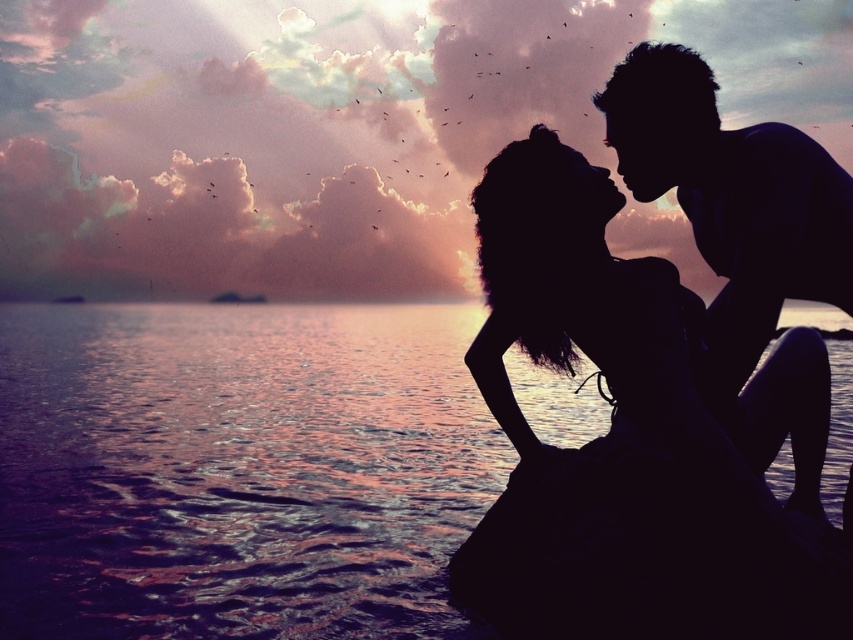
You are a photographer capturing this sunset scene. You want to focus on the point closer to the camera between the two points, point (775, 634) and point (671, 116). Which point should you adjust your camera to focus on?

You should focus on point (775, 634) because it is closer to the camera than point (671, 116).

You are a photographer trying to capture the couple in the sunset scene. The black matte dress at center and the silhouette man at upper right need to be in focus. If your camera has a depth of field that can sharply focus objects within 60 centimeters of each other, will both subjects be in focus?

The distance between the black matte dress at center and the silhouette man at upper right is 59.90 centimeters. Since this is within the 60 centimeter depth of field range, both subjects will be in focus.

You are a photographer planning to capture the sunset scene. You notice the reflective blue water at lower left and the silhouette man at upper right. Which object in the scene takes up more space in the photo?

The reflective blue water at lower left takes up more space in the photo because it is bigger than the silhouette man at upper right.